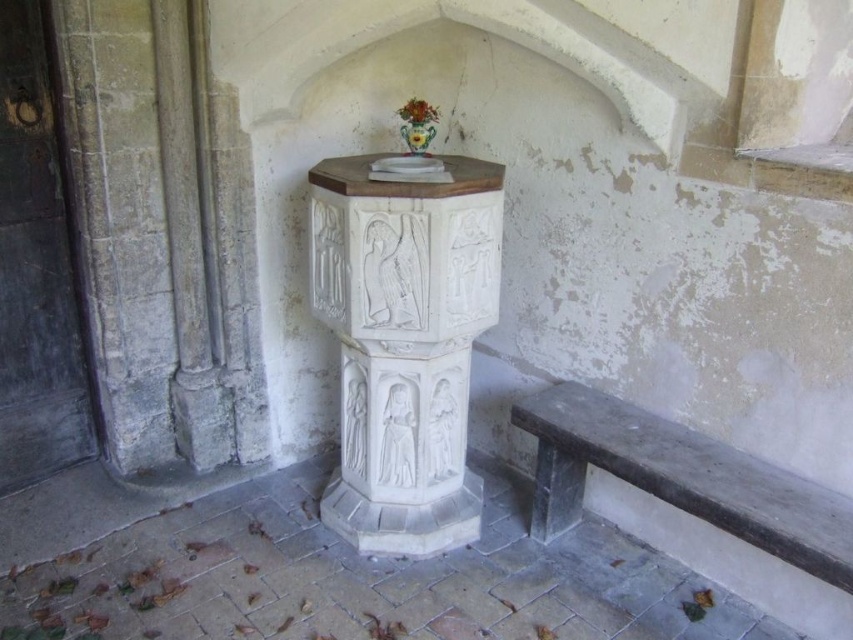
Question: Considering the real-world distances, which object is closest to the porcelain vase at upper center?

Choices:
 (A) green glazed vase at center
 (B) smooth gray bench at lower right
 (C) white stone baptismal font at center

Answer: (A)

Question: Which of the following is the farthest from the observer?

Choices:
 (A) porcelain vase at upper center
 (B) smooth gray bench at lower right

Answer: (A)

Question: Is smooth gray bench at lower right positioned behind porcelain vase at upper center?

Choices:
 (A) yes
 (B) no

Answer: (B)

Question: Does white stone baptismal font at center have a smaller size compared to green glazed vase at center?

Choices:
 (A) yes
 (B) no

Answer: (B)

Question: Which of the following is the closest to the observer?

Choices:
 (A) white stone baptismal font at center
 (B) smooth gray bench at lower right
 (C) porcelain vase at upper center
 (D) green glazed vase at center

Answer: (B)

Question: Is white stone baptismal font at center smaller than smooth gray bench at lower right?

Choices:
 (A) no
 (B) yes

Answer: (A)